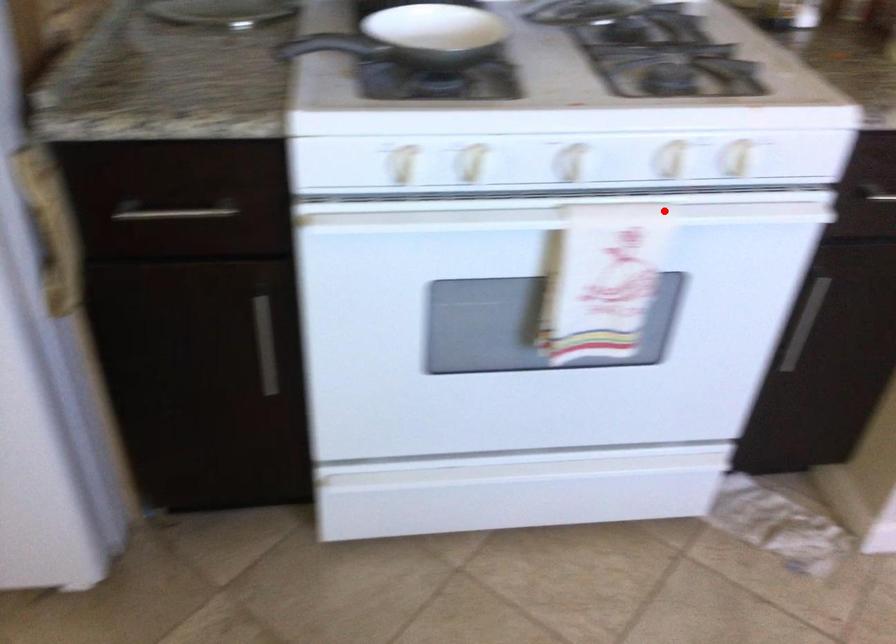
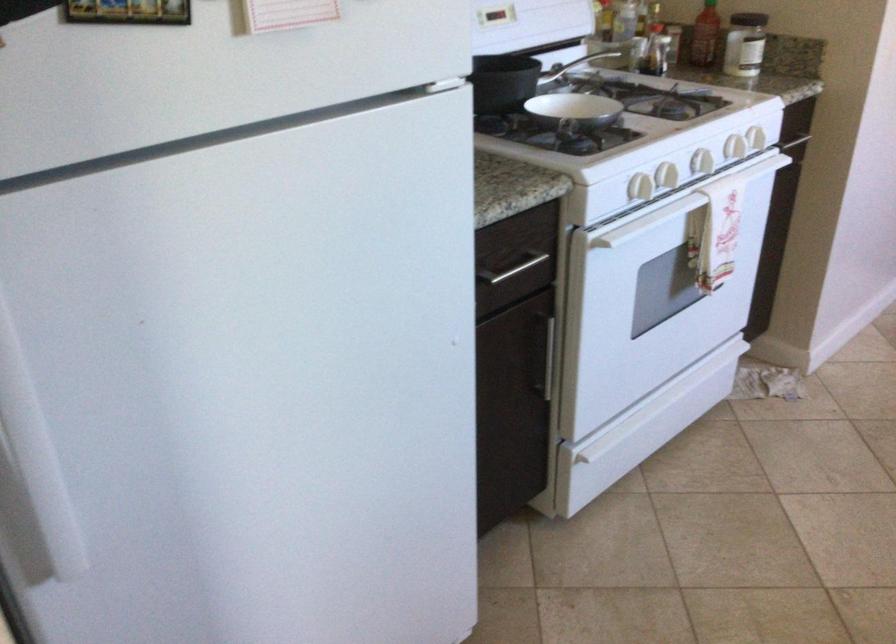
Where in the second image is the point corresponding to the highlighted location from the first image?

(755, 138)